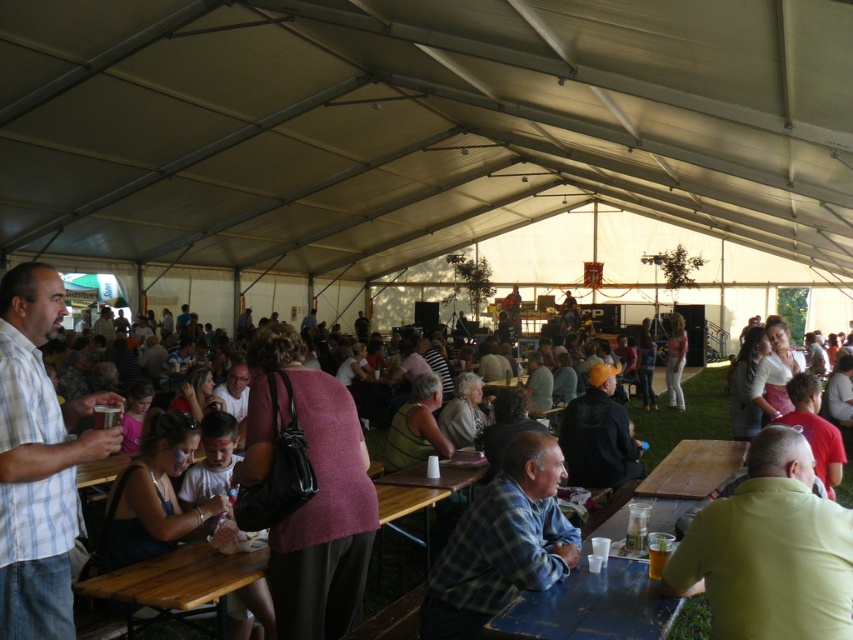
You are at the event and want to sit at the wooden table at lower center. However, there is a person wearing a light blue plaid shirt at left blocking your path. Can you walk around them to reach the table?

The light blue plaid shirt at left is in front of the wooden table at lower center, so you can walk around them to reach the table since they are blocking the front path.

You are a photographer at the event and want to capture both the light blue plaid shirt at left and the pink sweater at center in a single frame. Which clothing item should you focus on first to ensure both are in the shot?

The light blue plaid shirt at left is smaller than the pink sweater at center, so you should focus on the light blue plaid shirt at left first to ensure both are in the shot.